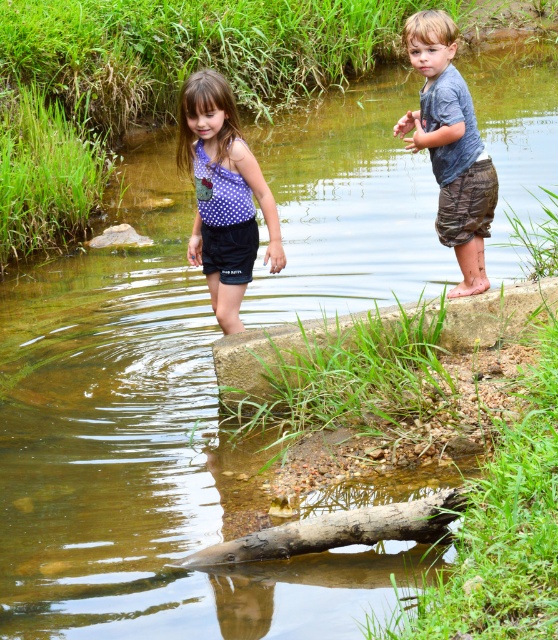
Which of these two, polka dot fabric dress at center or camouflage shorts at right, stands taller?

camouflage shorts at right

Does point (244, 212) lie behind point (482, 260)?

No, it is not.

Where is `polka dot fabric dress at center`? This screenshot has width=558, height=640. polka dot fabric dress at center is located at coordinates (223, 195).

Which is more to the right, green grassy stone at center or polka dot fabric dress at center?

green grassy stone at center is more to the right.

Can you confirm if green grassy stone at center is bigger than polka dot fabric dress at center?

Correct, green grassy stone at center is larger in size than polka dot fabric dress at center.

Which is in front, point (521, 310) or point (275, 216)?

Point (275, 216) is more forward.

At what (x,y) coordinates should I click in order to perform the action: click on green grassy stone at center. Please return your answer as a coordinate pair (x, y). Looking at the image, I should click on (364, 337).

Which is behind, point (206, 157) or point (437, 540)?

Point (206, 157)

At what (x,y) coordinates should I click in order to perform the action: click on polka dot fabric dress at center. Please return your answer as a coordinate pair (x, y). Image resolution: width=558 pixels, height=640 pixels. Looking at the image, I should click on (223, 195).

This screenshot has height=640, width=558. Describe the element at coordinates (223, 195) in the screenshot. I see `polka dot fabric dress at center` at that location.

Identify the location of polka dot fabric dress at center. (223, 195).